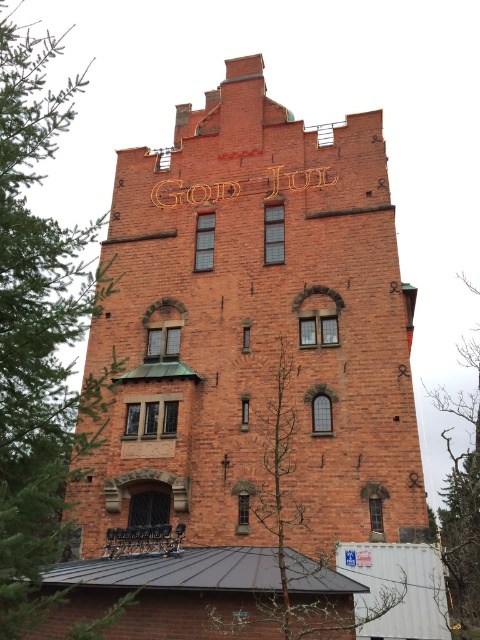
Question: Considering the relative positions of green leafy tree at left and bare branches at center in the image provided, where is green leafy tree at left located with respect to bare branches at center?

Choices:
 (A) right
 (B) left

Answer: (B)

Question: Does bare branches at center appear on the right side of bare branches at right?

Choices:
 (A) no
 (B) yes

Answer: (A)

Question: Which of the following is the closest to the observer?

Choices:
 (A) green leafy tree at left
 (B) bare branches at right
 (C) red brick tower at center
 (D) bare branches at center

Answer: (A)

Question: Does red brick tower at center have a greater width compared to bare branches at right?

Choices:
 (A) no
 (B) yes

Answer: (B)

Question: Which point is closer to the camera taking this photo?

Choices:
 (A) (13, 268)
 (B) (153, 241)
 (C) (478, 576)
 (D) (269, 417)

Answer: (A)

Question: Which point is farther from the camera taking this photo?

Choices:
 (A) (108, 304)
 (B) (22, 340)

Answer: (A)